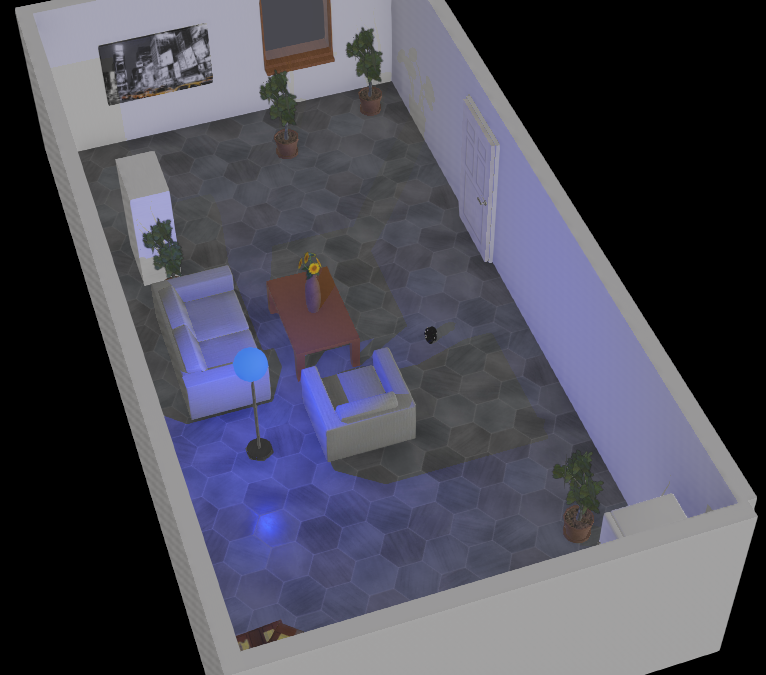
What are the coordinates of `potted plant` in the screenshot? It's located at (591, 502), (169, 252), (280, 107), (367, 63).